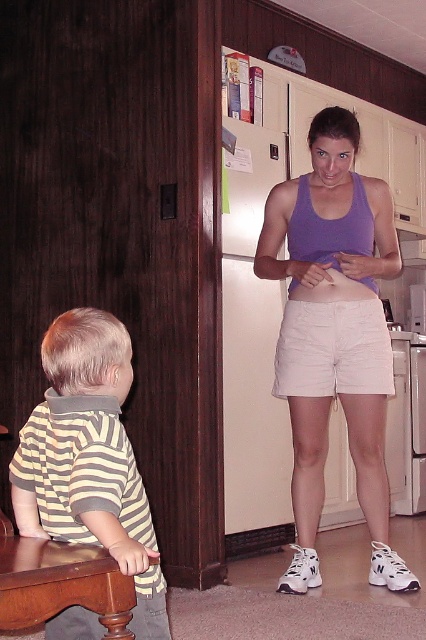
Does purple cotton tank top at center have a greater height compared to brown wood stool at lower left?

Yes, purple cotton tank top at center is taller than brown wood stool at lower left.

Does point (360, 326) come behind point (115, 616)?

Yes.

Does point (322, 244) come farther from viewer compared to point (48, 600)?

Yes, point (322, 244) is farther from viewer.

Image resolution: width=426 pixels, height=640 pixels. What are the coordinates of `purple cotton tank top at center` in the screenshot? It's located at (333, 336).

Is point (307, 225) positioned behind point (307, 380)?

Yes, point (307, 225) is farther from viewer.

Locate an element on the screen. purple cotton tank top at center is located at coordinates (333, 336).

Which of these two, purple cotton tank top at center or striped cotton shirt at left, stands shorter?

With less height is striped cotton shirt at left.

Looking at this image, who is higher up, purple cotton tank top at center or striped cotton shirt at left?

Positioned higher is purple cotton tank top at center.

Describe the element at coordinates (333, 336) in the screenshot. I see `purple cotton tank top at center` at that location.

Locate an element on the screen. Image resolution: width=426 pixels, height=640 pixels. purple cotton tank top at center is located at coordinates (333, 336).